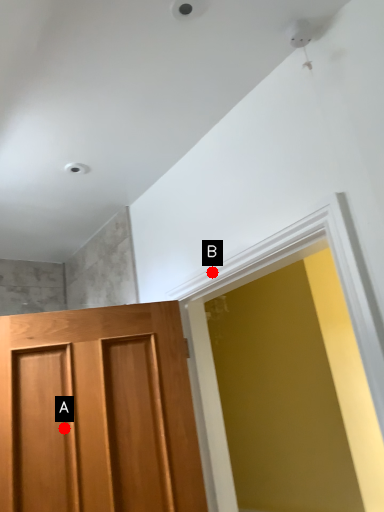
Question: Two points are circled on the image, labeled by A and B beside each circle. Which point appears closest to the camera in this image?

Choices:
 (A) A is closer
 (B) B is closer

Answer: (A)